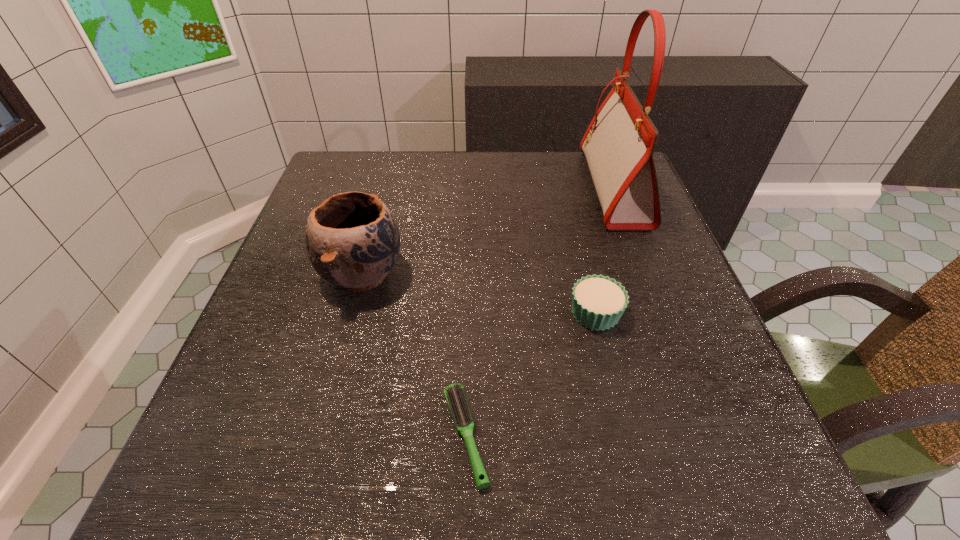
The image size is (960, 540). What are the coordinates of `free point between the pottery and the shortest object` in the screenshot? It's located at (414, 355).

Find the location of `vacant region between the third shortest object and the shortest object`. vacant region between the third shortest object and the shortest object is located at coordinates (414, 355).

Where is `empty space between the shortest object and the rightmost object`? The width and height of the screenshot is (960, 540). empty space between the shortest object and the rightmost object is located at coordinates (540, 312).

Locate an element on the screen. This screenshot has height=540, width=960. the closest object to the nearest object is located at coordinates (598, 302).

The height and width of the screenshot is (540, 960). I want to click on object that is the closest one to the cupcake, so click(619, 143).

The image size is (960, 540). Find the location of `vacant space that satisfies the following two spatial constraints: 1. on the back side of the third object from right to left; 2. on the right side of the second object from right to left`. vacant space that satisfies the following two spatial constraints: 1. on the back side of the third object from right to left; 2. on the right side of the second object from right to left is located at coordinates (468, 313).

At what (x,y) coordinates should I click in order to perform the action: click on vacant area that satisfies the following two spatial constraints: 1. on the back side of the third object from left to right; 2. on the right side of the farthest object. Please return your answer as a coordinate pair (x, y). The image size is (960, 540). Looking at the image, I should click on (565, 188).